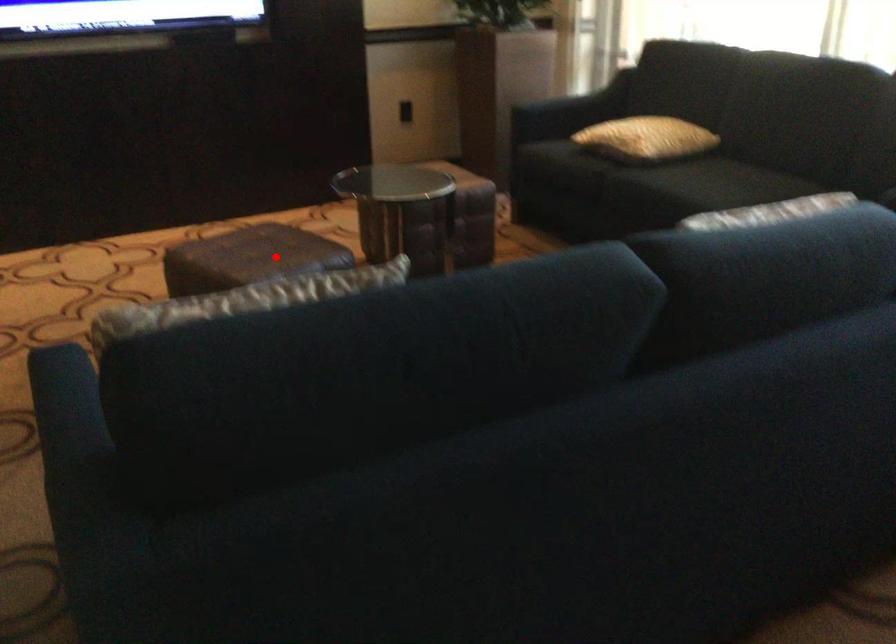
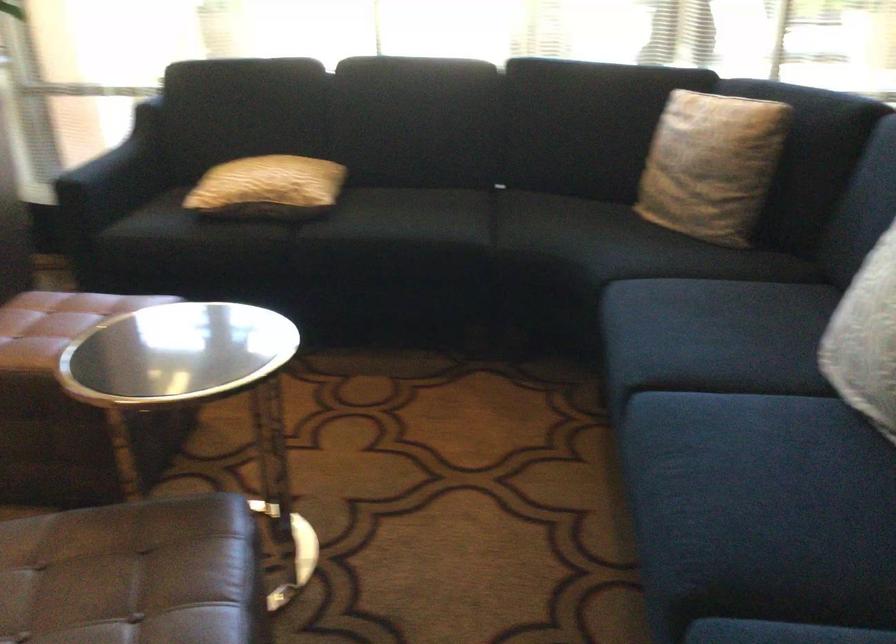
Find the pixel in the second image that matches the highlighted location in the first image.

(134, 574)